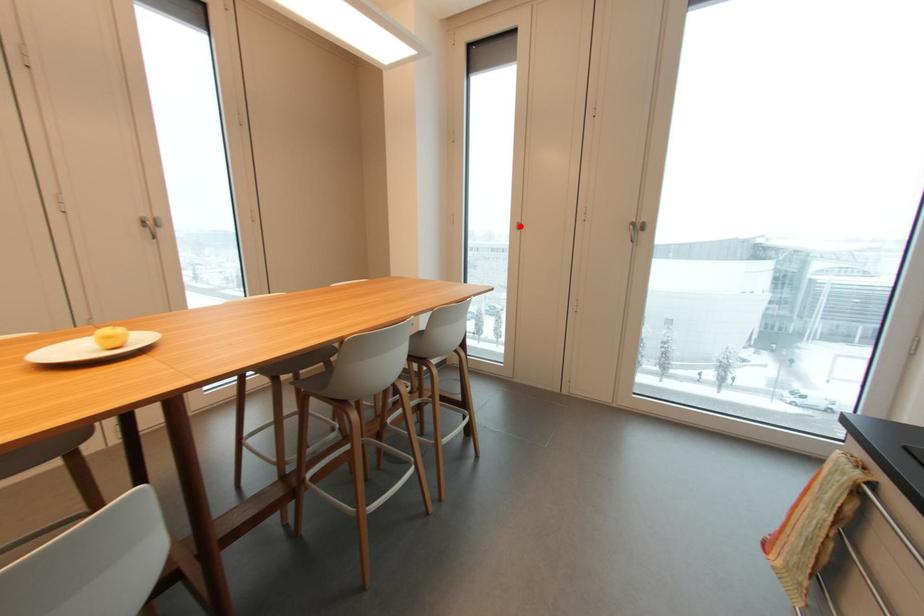
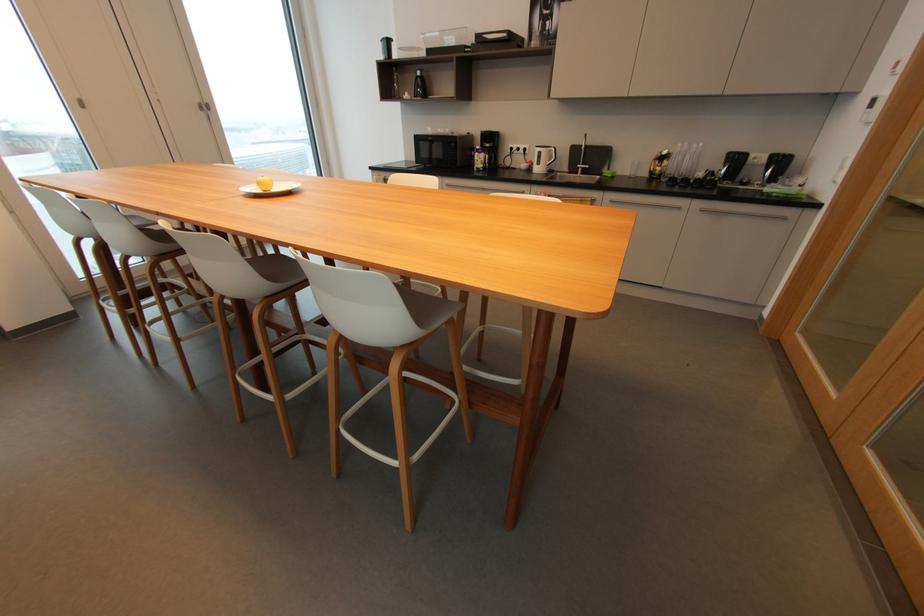
In the second image, find the point that corresponds to the highlighted location in the first image.

(81, 103)